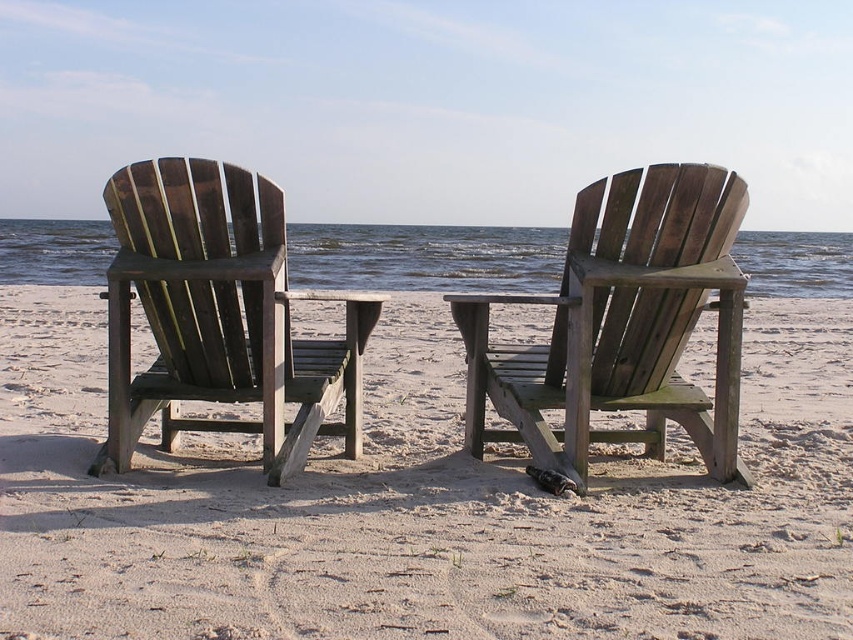
You are standing on the beach and want to sit down on one of the chairs. Which chair, the weathered wood chairs at center or the wooden beach chair at center, is closer to you?

The weathered wood chairs at center is closer to the viewer than the wooden beach chair at center, so you should choose the weathered wood chairs at center.

You are a photographer wanting to capture both the wooden beach chair at center and the dark brown wood beach chair at left in a single shot. Based on their positions, which chair should you position closer to the left edge of the frame to include both?

You should position the dark brown wood beach chair at left closer to the left edge of the frame since it is already to the left of the wooden beach chair at center.

You are planning to set up a small picnic table between the weathered wood chairs at center and the wooden beach chair at center. Which chair should the picnic table be placed closer to to ensure it fits within the space?

The picnic table should be placed closer to the wooden beach chair at center because the weathered wood chairs at center are wider, so positioning the picnic table near the narrower wooden beach chair at center allows for better space utilization.